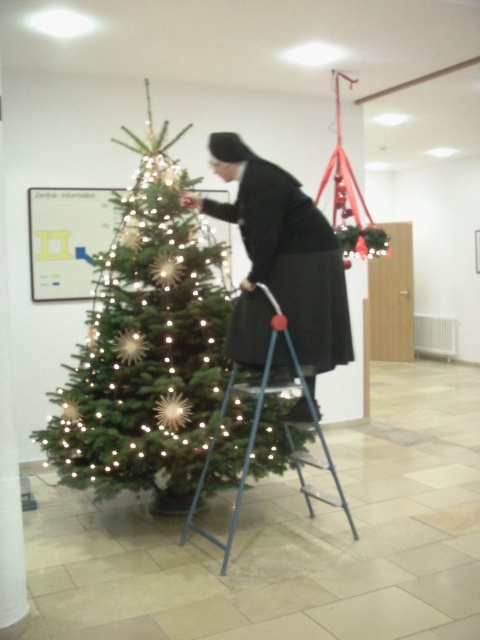
Question: Which object is positioned farthest from the black matte dress at center?

Choices:
 (A) blue metallic ladder at center
 (B) green matte christmas tree at center

Answer: (B)

Question: Which point appears closest to the camera in this image?

Choices:
 (A) (326, 291)
 (B) (120, 268)
 (C) (244, 464)

Answer: (C)

Question: Where is green matte christmas tree at center located in relation to black matte dress at center in the image?

Choices:
 (A) above
 (B) below

Answer: (B)

Question: Considering the real-world distances, which object is closest to the black matte dress at center?

Choices:
 (A) green matte christmas tree at center
 (B) blue metallic ladder at center

Answer: (B)

Question: Does black matte dress at center have a smaller size compared to blue metallic ladder at center?

Choices:
 (A) yes
 (B) no

Answer: (A)

Question: Is green matte christmas tree at center to the left of black matte dress at center from the viewer's perspective?

Choices:
 (A) no
 (B) yes

Answer: (B)